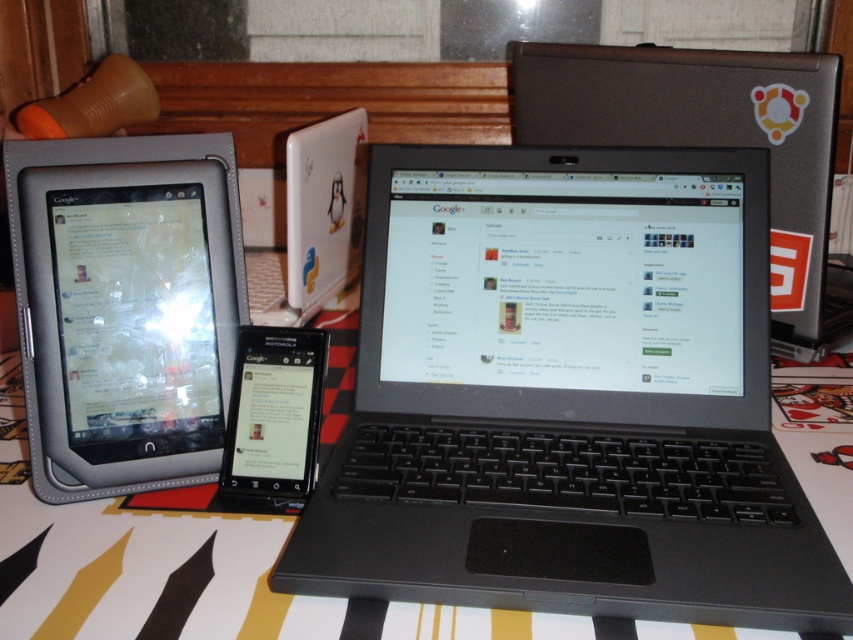
Who is more distant from viewer, (608, 328) or (248, 472)?

The point (608, 328) is behind.

Is black plastic laptop at center smaller than black glossy tablet at center?

Actually, black plastic laptop at center might be larger than black glossy tablet at center.

Is point (547, 444) in front of point (280, 420)?

No, it is not.

Locate an element on the screen. black plastic laptop at center is located at coordinates (567, 396).

Can you confirm if leather-like tablet at left is taller than black glossy tablet at center?

Correct, leather-like tablet at left is much taller as black glossy tablet at center.

Can you confirm if leather-like tablet at left is positioned to the right of black glossy tablet at center?

No, leather-like tablet at left is not to the right of black glossy tablet at center.

Image resolution: width=853 pixels, height=640 pixels. Describe the element at coordinates (123, 305) in the screenshot. I see `leather-like tablet at left` at that location.

Image resolution: width=853 pixels, height=640 pixels. What are the coordinates of `leather-like tablet at left` in the screenshot? It's located at (123, 305).

Can you confirm if black plastic laptop at center is positioned above leather-like tablet at left?

No, black plastic laptop at center is not above leather-like tablet at left.

Is black plastic laptop at center bigger than leather-like tablet at left?

Yes, black plastic laptop at center is bigger than leather-like tablet at left.

Measure the distance between black plastic laptop at center and camera.

black plastic laptop at center is 41.68 centimeters from camera.

Where is `black plastic laptop at center`? Image resolution: width=853 pixels, height=640 pixels. black plastic laptop at center is located at coordinates (567, 396).